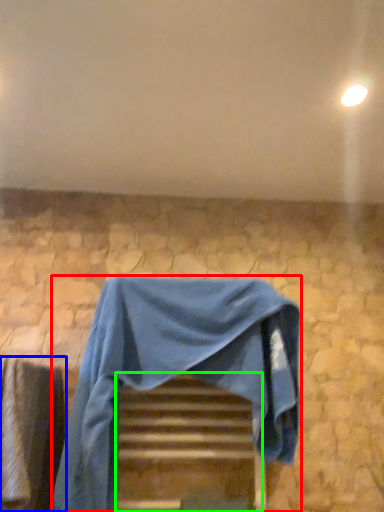
Question: Which is nearer to the furniture (highlighted by a red box)? curtain (highlighted by a blue box) or stairwell (highlighted by a green box).

Choices:
 (A) curtain
 (B) stairwell

Answer: (B)